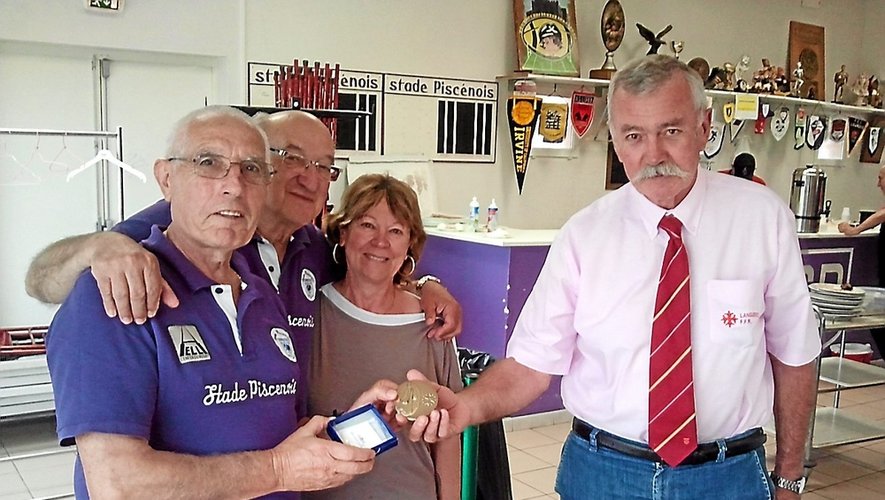
Locate an element on the screen. The width and height of the screenshot is (885, 500). wall is located at coordinates (394, 32).